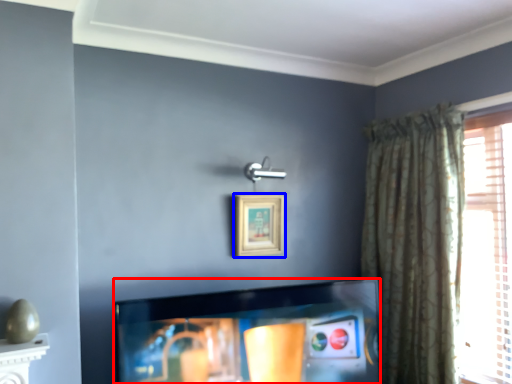
Question: Which object is closer to the camera taking this photo, television (highlighted by a red box) or picture frame (highlighted by a blue box)?

Choices:
 (A) television
 (B) picture frame

Answer: (A)